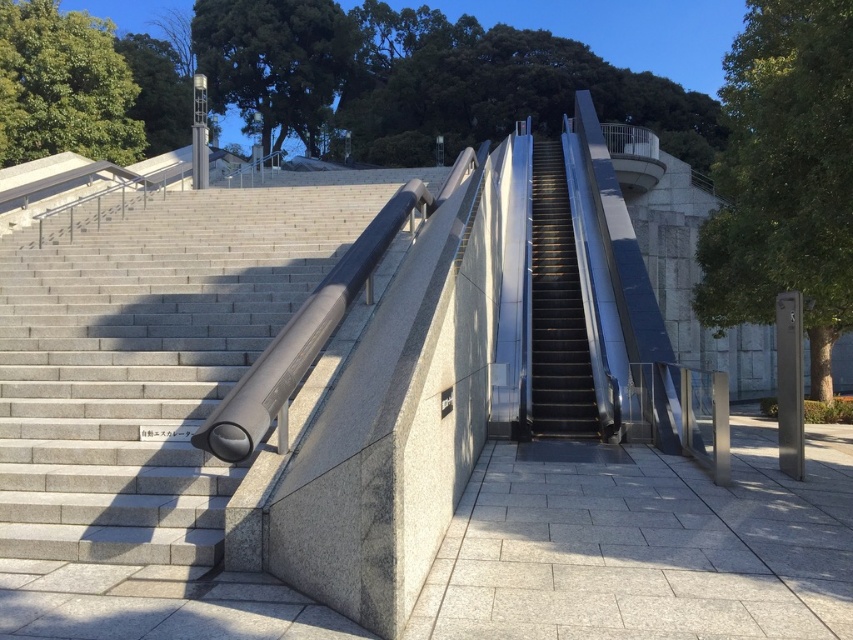
Looking at this image, you are a delivery person carrying a heavy box and need to choose between the gray concrete stairs at left and the black metal escalator at center to reach the upper floor. Which option would allow you to reach the top faster?

The black metal escalator at center is taller than the gray concrete stairs at left, so the escalator would likely move you upward faster than climbing the stairs.

You are a delivery person carrying a heavy box and need to choose between the gray concrete stairs at left and the black metal escalator at center to reach the upper floor. Based on their positions, which one is more to the left?

The gray concrete stairs at left is positioned on the left side of black metal escalator at center, so it is more to the left.

You are standing at the entrance of the urban area and want to reach the upper floor. The gray concrete stairs at left are located at point 0.569, 0.172. Can you determine the direction you should walk to reach them?

The gray concrete stairs at left are located at point [146,364], so you should walk towards the left side to reach them.